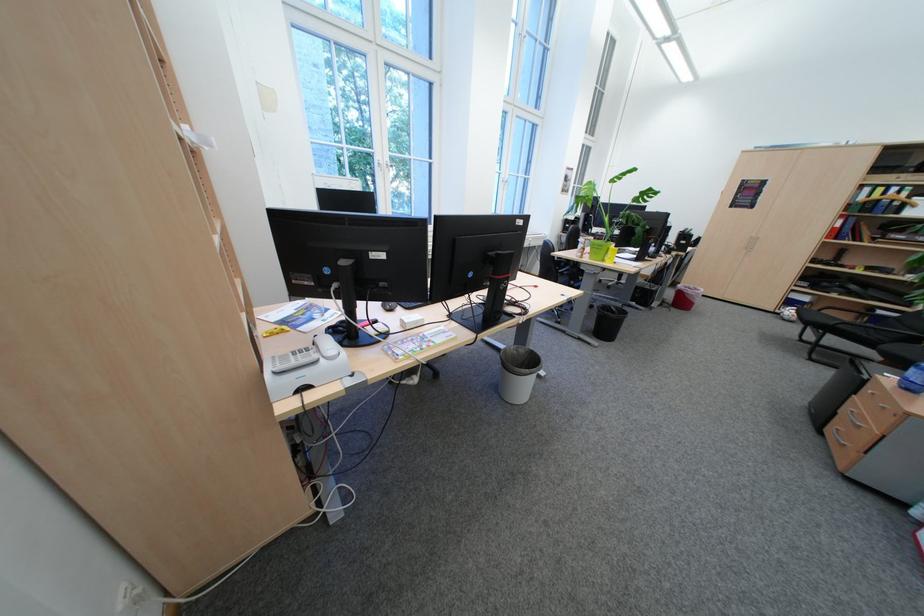
The height and width of the screenshot is (616, 924). What do you see at coordinates (517, 373) in the screenshot? I see `a white trash can` at bounding box center [517, 373].